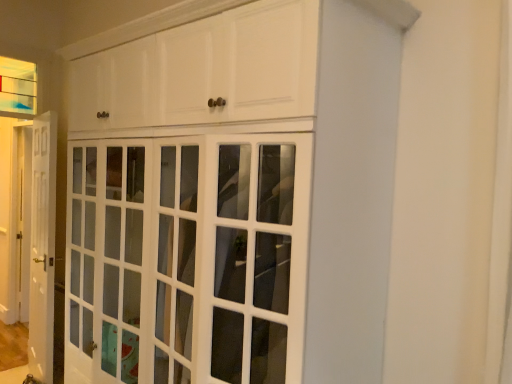
Question: Is point pyautogui.click(x=45, y=167) closer or farther from the camera than point pyautogui.click(x=313, y=281)?

Choices:
 (A) closer
 (B) farther

Answer: (B)

Question: From the image's perspective, relative to white glossy cabinet at center, is white glossy door at left above or below?

Choices:
 (A) below
 (B) above

Answer: (A)

Question: Which object is positioned farthest from the clear glass window at upper left?

Choices:
 (A) white glossy cabinet at center
 (B) white glossy door at left

Answer: (A)

Question: Based on their relative distances, which object is farther from the clear glass window at upper left?

Choices:
 (A) white glossy door at left
 (B) white glossy cabinet at center

Answer: (B)